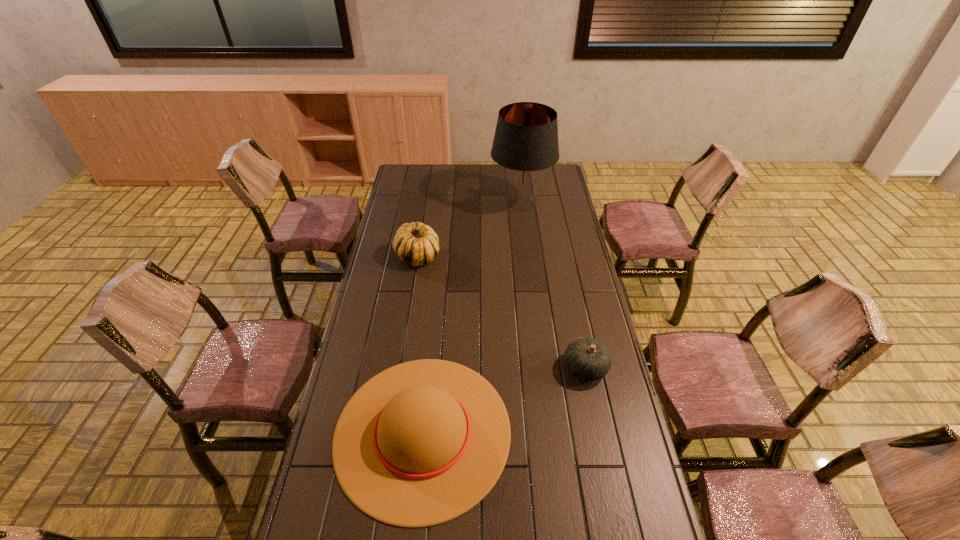
This screenshot has height=540, width=960. Identify the location of free space located on the back of the shorter gourd. (571, 305).

The height and width of the screenshot is (540, 960). What are the coordinates of `gourd situated at the left edge` in the screenshot? It's located at pyautogui.click(x=416, y=244).

At what (x,y) coordinates should I click in order to perform the action: click on sombrero present at the left edge. Please return your answer as a coordinate pair (x, y). The image size is (960, 540). Looking at the image, I should click on coord(421,443).

Where is `lampshade that is positioned at the right edge`? This screenshot has height=540, width=960. lampshade that is positioned at the right edge is located at coordinates (525, 145).

Where is `gourd that is at the right edge`? The height and width of the screenshot is (540, 960). gourd that is at the right edge is located at coordinates (586, 358).

Where is `vacant space at the far edge of the desktop`? This screenshot has height=540, width=960. vacant space at the far edge of the desktop is located at coordinates (435, 170).

At what (x,y) coordinates should I click in order to perform the action: click on vacant region at the left edge of the desktop. Please return your answer as a coordinate pair (x, y). Looking at the image, I should click on (385, 332).

Identify the location of vacant region at the right edge of the desktop. The height and width of the screenshot is (540, 960). (612, 448).

At what (x,y) coordinates should I click in order to perform the action: click on blank space at the far left corner. Please return your answer as a coordinate pair (x, y). Looking at the image, I should click on (398, 181).

At what (x,y) coordinates should I click in order to perform the action: click on free space between the left gourd and the farthest object. Please return your answer as a coordinate pair (x, y). The image size is (960, 540). Looking at the image, I should click on click(469, 231).